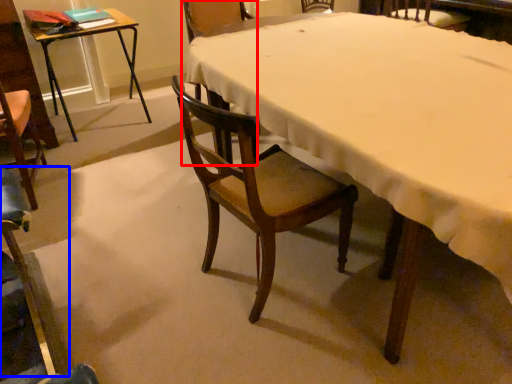
Question: Which object appears closest to the camera in this image, chair (highlighted by a red box) or chair (highlighted by a blue box)?

Choices:
 (A) chair
 (B) chair

Answer: (B)